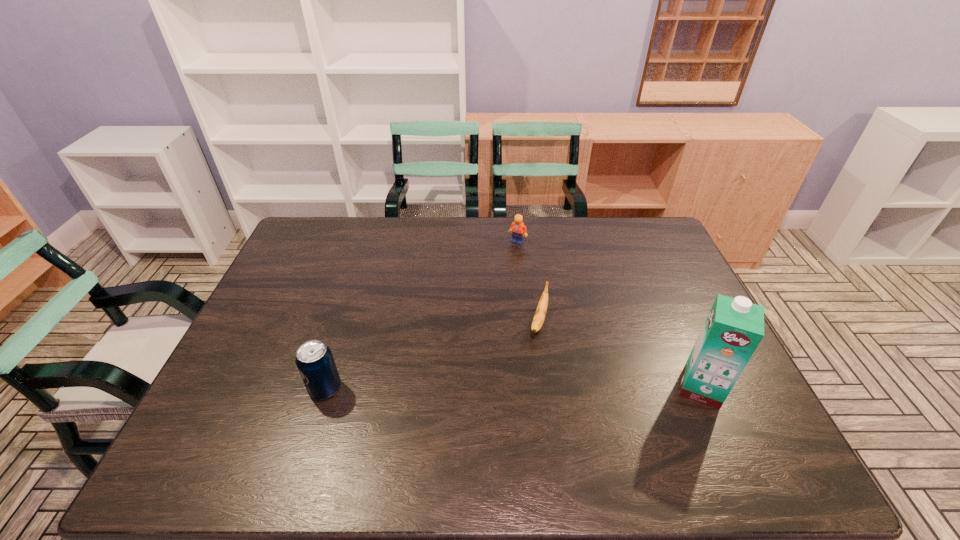
I want to click on the leftmost object, so click(x=314, y=360).

Locate an element on the screen. The width and height of the screenshot is (960, 540). soda can is located at coordinates (314, 360).

Where is `the tallest object`? This screenshot has width=960, height=540. the tallest object is located at coordinates (734, 327).

Where is `the rightmost object`? the rightmost object is located at coordinates pyautogui.click(x=734, y=327).

Where is `the farthest object`? The height and width of the screenshot is (540, 960). the farthest object is located at coordinates (518, 229).

You are a GUI agent. You are given a task and a screenshot of the screen. Output one action in this format:
    pyautogui.click(x=<x>, y=<y>)
    Task: Click on the Lego
    
    Given the screenshot: What is the action you would take?
    pyautogui.click(x=518, y=229)

In order to click on banana in this screenshot , I will do `click(539, 317)`.

Find the location of a particular element. This screenshot has width=960, height=540. the shortest object is located at coordinates (539, 317).

The width and height of the screenshot is (960, 540). In order to click on vacant space located 0.050m on the front of the second tallest object in this screenshot , I will do `click(315, 421)`.

At what (x,y) coordinates should I click in order to perform the action: click on vacant space located 0.250m on the left of the tallest object. Please return your answer as a coordinate pair (x, y). This screenshot has height=540, width=960. Looking at the image, I should click on (575, 388).